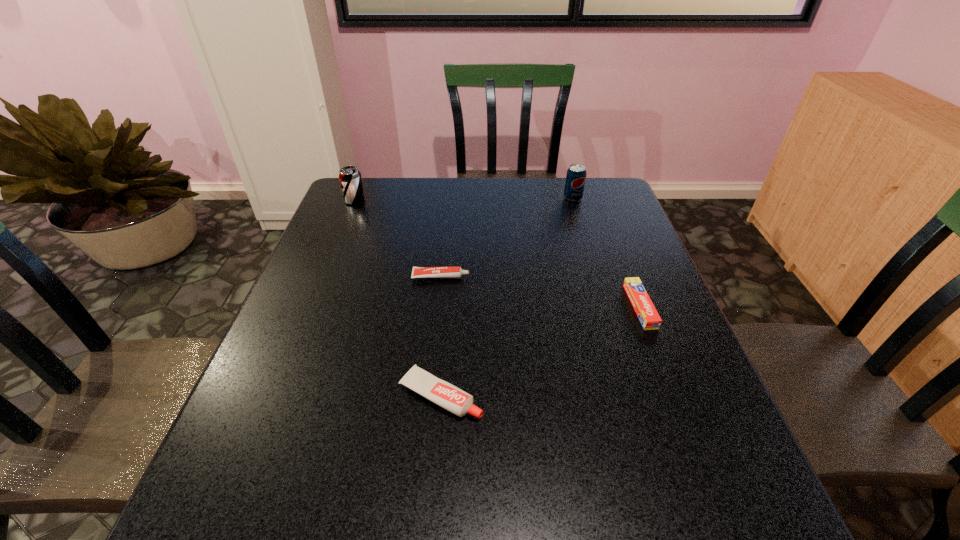
You are a GUI agent. You are given a task and a screenshot of the screen. Output one action in this format:
    pyautogui.click(x=<x>, y=<y>)
    Task: Click on the free space that satisfies the following two spatial constraints: 1. at the nozzle of the third nearest object; 2. on the right side of the tallest toothpaste
    
    Given the screenshot: What is the action you would take?
    pyautogui.click(x=429, y=395)